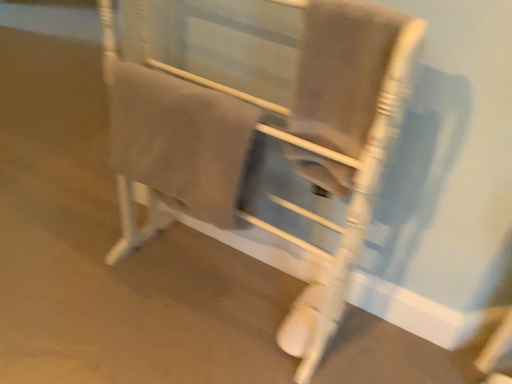
What are the coordinates of `free space to the left of matte white chair at center` in the screenshot? It's located at (75, 279).